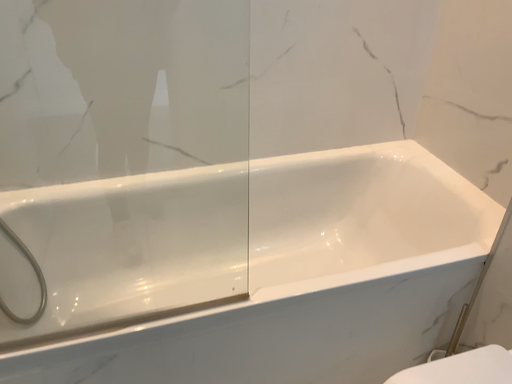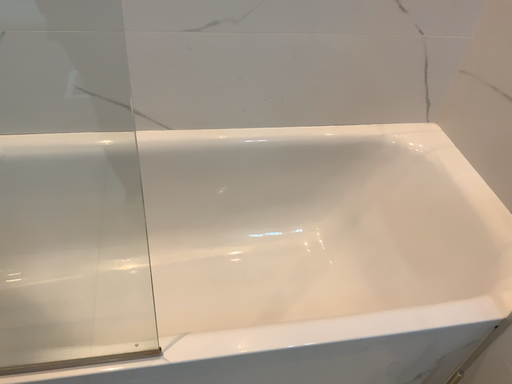
Question: Which way did the camera rotate in the video?

Choices:
 (A) rotated downward
 (B) rotated upward

Answer: (A)